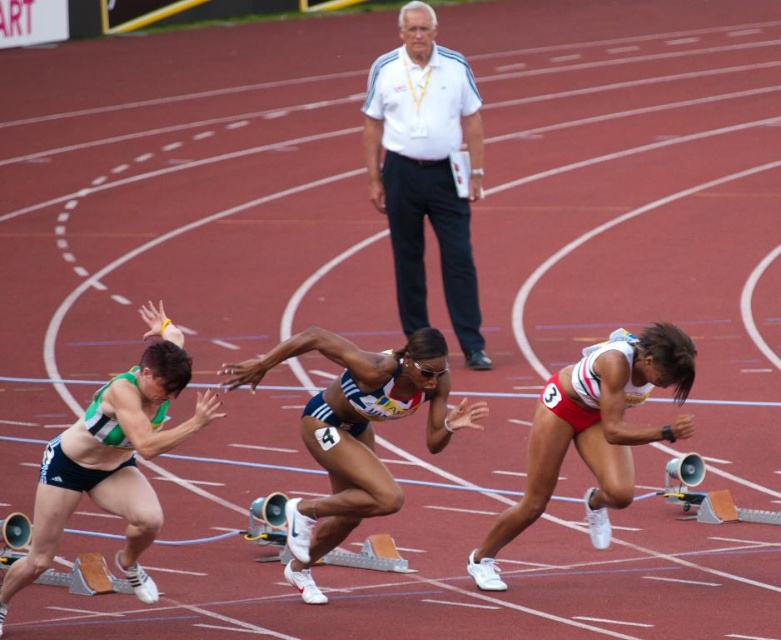
Question: Is white athletic uniform at center positioned in front of green matte shorts at left?

Choices:
 (A) yes
 (B) no

Answer: (B)

Question: Is white smooth shirt at upper center bigger than green matte shorts at left?

Choices:
 (A) yes
 (B) no

Answer: (A)

Question: Among these objects, which one is nearest to the camera?

Choices:
 (A) green matte shorts at left
 (B) white smooth shirt at upper center

Answer: (A)

Question: Is white smooth shirt at upper center thinner than white matte running shoe at lower right?

Choices:
 (A) no
 (B) yes

Answer: (B)

Question: Among these objects, which one is farthest from the camera?

Choices:
 (A) white athletic uniform at center
 (B) white matte running shoe at lower right
 (C) green matte shorts at left

Answer: (A)

Question: Which point is closer to the camera taking this photo?

Choices:
 (A) click(341, 468)
 (B) click(77, 461)
 (C) click(377, 179)
 (D) click(562, 435)

Answer: (B)